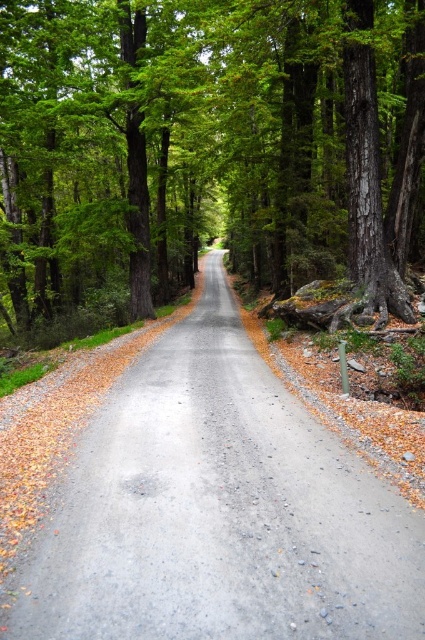
Question: Considering the relative positions of brown textured tree at center and gray asphalt road at center in the image provided, where is brown textured tree at center located with respect to gray asphalt road at center?

Choices:
 (A) above
 (B) below

Answer: (A)

Question: Which of the following is the closest to the observer?

Choices:
 (A) brown textured tree at center
 (B) gray asphalt road at center

Answer: (B)

Question: Which point is farther from the camera taking this photo?

Choices:
 (A) (195, 374)
 (B) (0, 160)

Answer: (B)

Question: Which point is farther to the camera?

Choices:
 (A) brown textured tree at center
 (B) gray asphalt road at center

Answer: (A)

Question: Can you confirm if brown textured tree at center is positioned to the right of gray asphalt road at center?

Choices:
 (A) yes
 (B) no

Answer: (B)

Question: Does brown textured tree at center have a greater width compared to gray asphalt road at center?

Choices:
 (A) no
 (B) yes

Answer: (B)